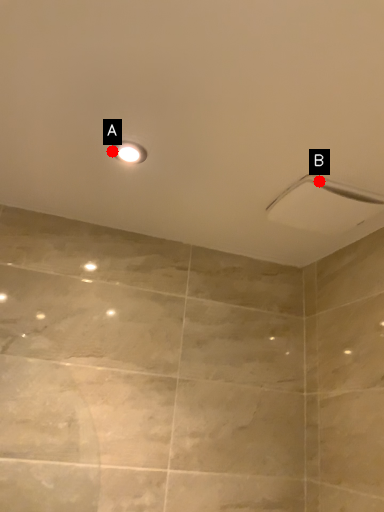
Question: Two points are circled on the image, labeled by A and B beside each circle. Which point appears farthest from the camera in this image?

Choices:
 (A) A is further
 (B) B is further

Answer: (B)